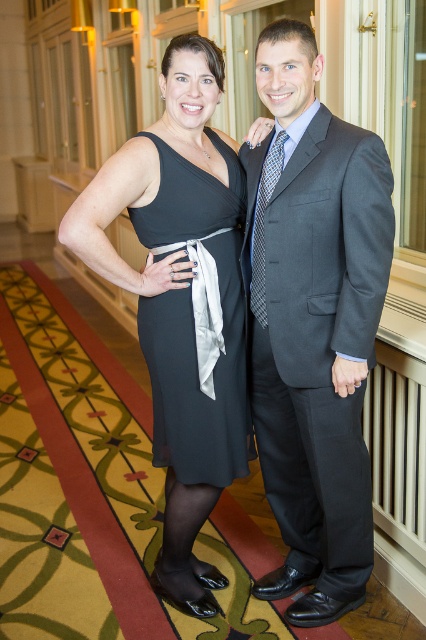
You are a photographer at a formal event. You need to adjust the lighting to ensure both the black chiffon dress at center and the blue textured tie at center are well lit. Since the dress is on one side, which direction should you move the light source to evenly illuminate both?

The black chiffon dress at center is positioned on the left side of the blue textured tie at center. To evenly illuminate both, move the light source to the right side of the blue textured tie at center so it reaches both objects.

You are a photographer at a formal event. You need to ensure that the black chiffon dress at center and the blue textured tie at center are both visible in the photo. Given that the dress is larger, which object will require more space in the frame?

The black chiffon dress at center is larger in size than the blue textured tie at center, so it will require more space in the frame.